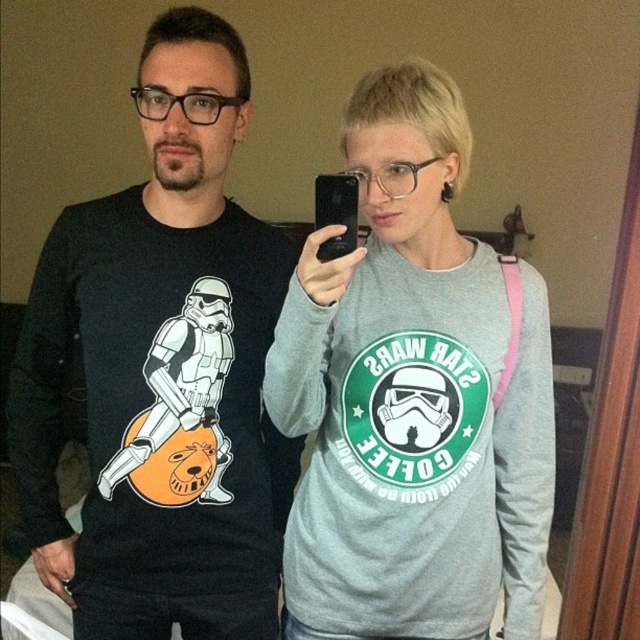
Is black matte t-shirt at center bigger than gray matte sweatshirt at center?

Yes, black matte t-shirt at center is bigger than gray matte sweatshirt at center.

The height and width of the screenshot is (640, 640). I want to click on black matte t-shirt at center, so click(161, 371).

Who is more distant from viewer, (x=81, y=342) or (x=492, y=586)?

Point (x=81, y=342)

At what (x,y) coordinates should I click in order to perform the action: click on black matte t-shirt at center. Please return your answer as a coordinate pair (x, y). Looking at the image, I should click on (161, 371).